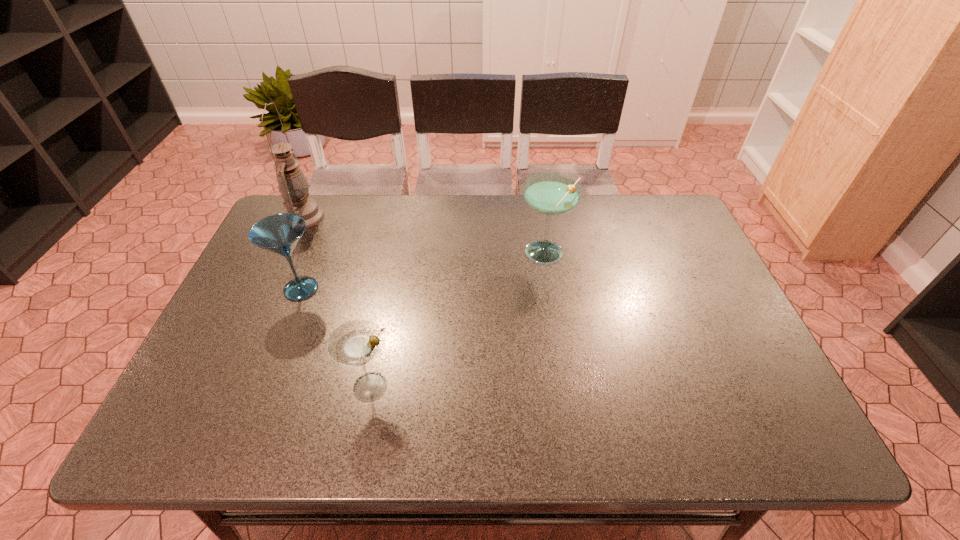
I want to click on vacant area that lies between the rightmost object and the nearest martini, so click(x=458, y=321).

The width and height of the screenshot is (960, 540). In order to click on free space that is in between the rightmost martini and the leftmost martini in this screenshot , I will do `click(423, 272)`.

This screenshot has width=960, height=540. I want to click on free space between the nearest object and the tallest object, so click(337, 302).

Identify the location of vacant area that lies between the rightmost object and the tallest object. Image resolution: width=960 pixels, height=540 pixels. [424, 235].

You are a GUI agent. You are given a task and a screenshot of the screen. Output one action in this format:
    pyautogui.click(x=<x>, y=<y>)
    Task: Click on the vacant area that lies between the nearest object and the rightmost object
    
    Given the screenshot: What is the action you would take?
    pyautogui.click(x=458, y=321)

Where is `empty space that is in between the nearest martini and the rightmost martini`? The image size is (960, 540). empty space that is in between the nearest martini and the rightmost martini is located at coordinates (458, 321).

In order to click on empty space between the rightmost object and the tallest object in this screenshot , I will do `click(424, 235)`.

Locate an element on the screen. empty space that is in between the farthest object and the leftmost martini is located at coordinates (302, 253).

Find the location of a particular element. This screenshot has height=540, width=960. empty space that is in between the rightmost martini and the third object from left to right is located at coordinates (458, 321).

At what (x,y) coordinates should I click in order to perform the action: click on object that can be found as the third closest to the leftmost martini. Please return your answer as a coordinate pair (x, y). The image size is (960, 540). Looking at the image, I should click on (550, 193).